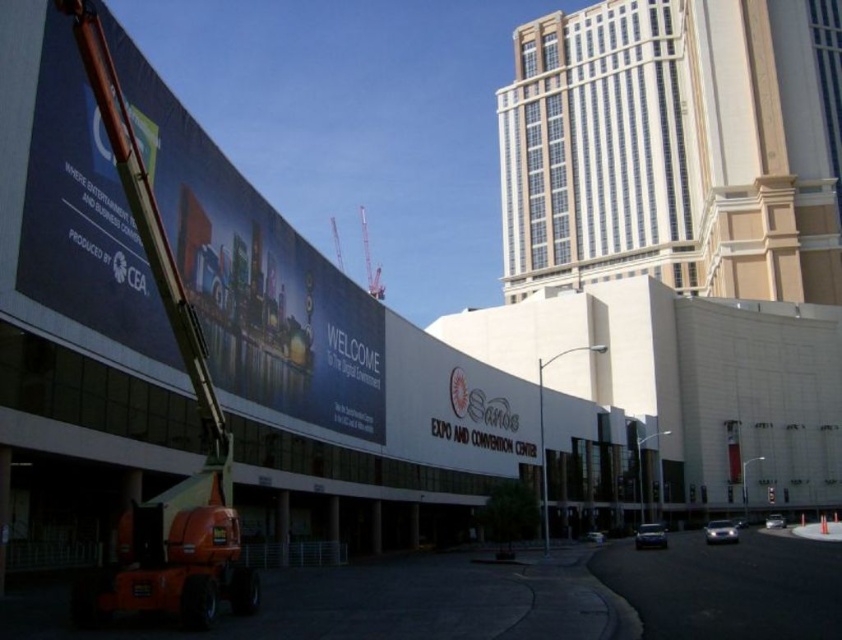
Question: Among these points, which one is nearest to the camera?

Choices:
 (A) (377, 278)
 (B) (209, 348)

Answer: (B)

Question: Is blue glossy billboard at upper left positioned at the back of metallic red crane at center?

Choices:
 (A) yes
 (B) no

Answer: (B)

Question: Can you confirm if blue glossy billboard at upper left is positioned to the right of metallic red crane at center?

Choices:
 (A) no
 (B) yes

Answer: (B)

Question: Which object is farther from the camera taking this photo?

Choices:
 (A) metallic red crane at center
 (B) blue glossy billboard at upper left

Answer: (A)

Question: Can you confirm if blue glossy billboard at upper left is positioned to the right of metallic red crane at center?

Choices:
 (A) no
 (B) yes

Answer: (B)

Question: Which object is farther from the camera taking this photo?

Choices:
 (A) metallic red crane at center
 (B) blue glossy billboard at upper left

Answer: (A)